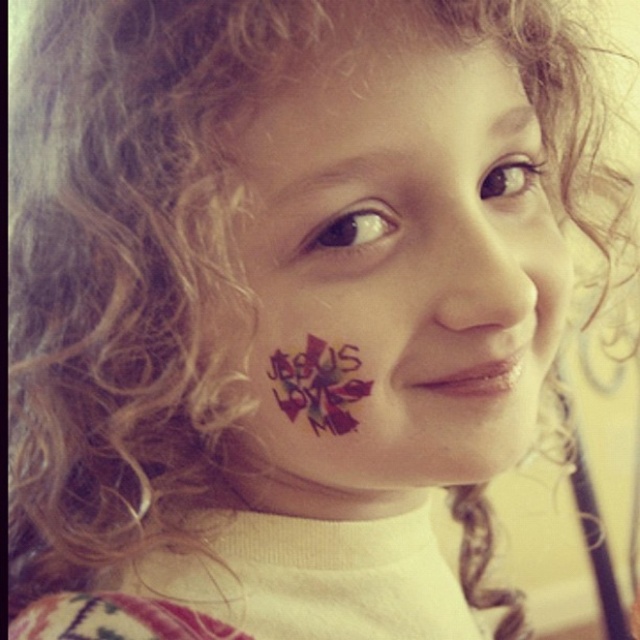
Based on the scene, which object is taller between the dark red matte text at cheek center and the multicolored painted flower at center?

The dark red matte text at cheek center is much taller than the multicolored painted flower at center.

Based on the scene, which object has a larger size between the dark red matte text at cheek center and the matte skin nose at center?

The dark red matte text at cheek center is larger in size compared to the matte skin nose at center.